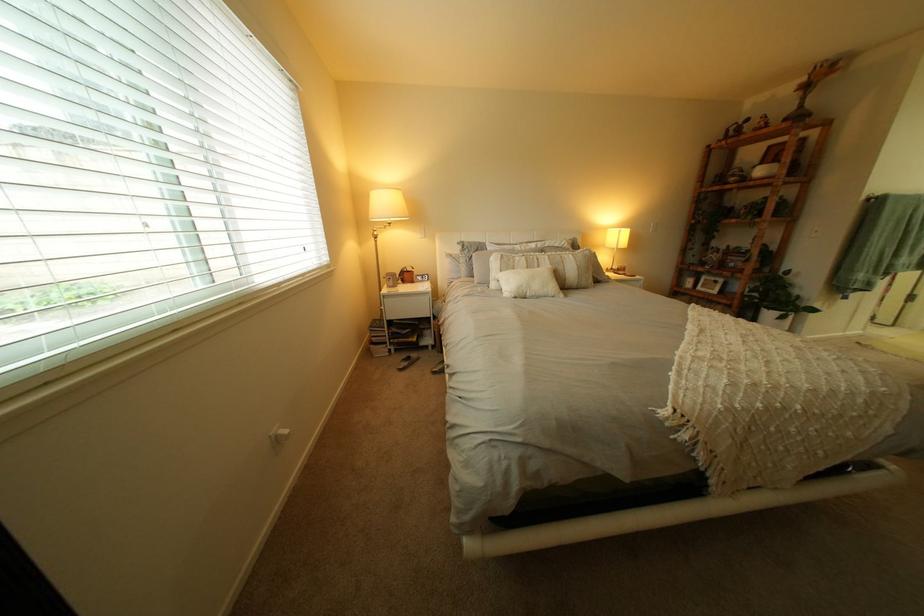
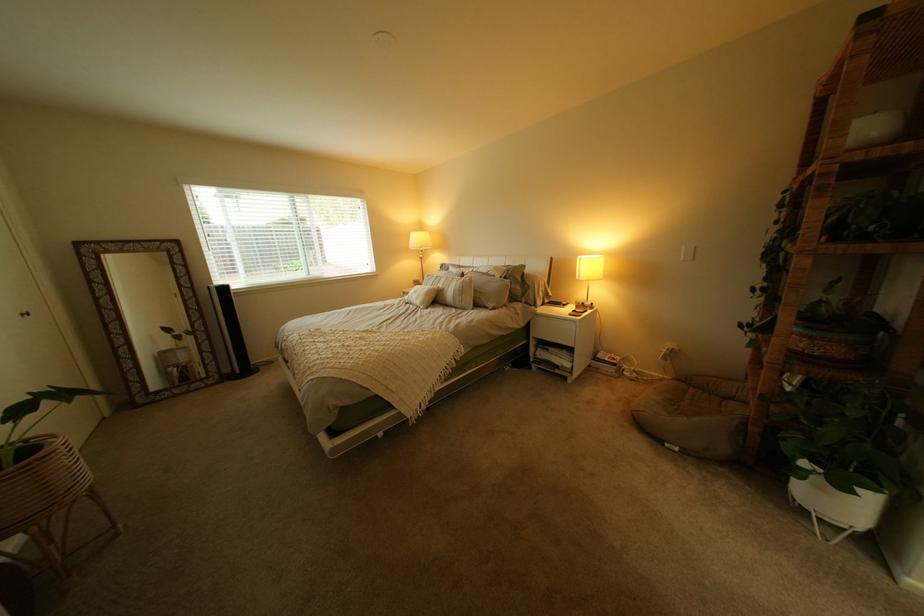
In the second image, find the point that corresponds to point 624,283 in the first image.

(509, 310)